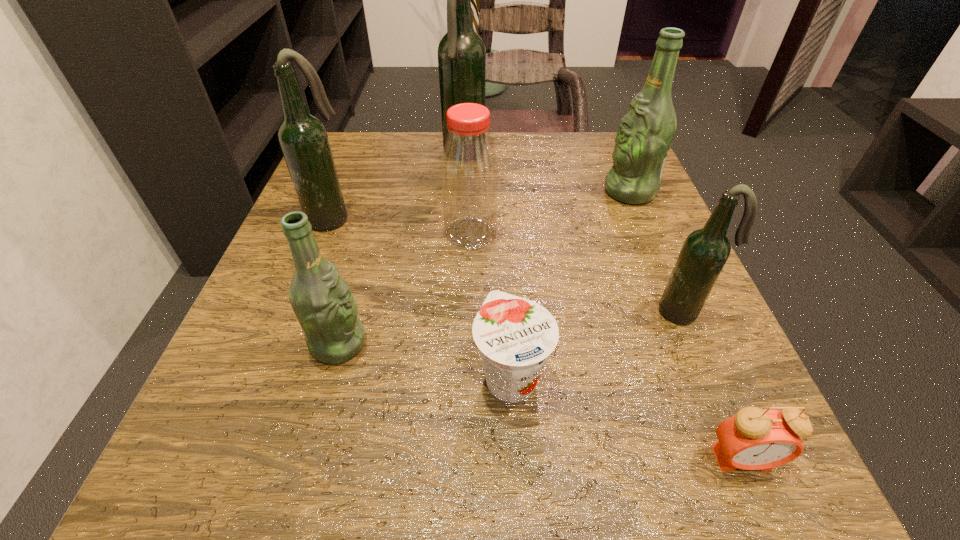
Locate an element on the screen. This screenshot has height=540, width=960. vacant area between the third beer bottle from right to left and the yogurt is located at coordinates click(488, 266).

Locate an element on the screen. free space between the yogurt and the nearest object is located at coordinates [626, 417].

Choose which object is the fifth nearest neighbor to the red bottle. Please provide its 2D coordinates. Your answer should be formatted as a tuple, i.e. [(x, y)], where the tuple contains the x and y coordinates of a point satisfying the conditions above.

[(646, 132)]

Locate an element on the screen. The image size is (960, 540). object that is the closest one to the tallest object is located at coordinates (469, 166).

At what (x,y) coordinates should I click in order to perform the action: click on beer bottle that stands as the third closest to the tallest beer bottle. Please return your answer as a coordinate pair (x, y). This screenshot has width=960, height=540. Looking at the image, I should click on (322, 301).

Identify the location of the closest beer bottle to the alarm clock. (705, 251).

Image resolution: width=960 pixels, height=540 pixels. In order to click on dark beer bottle that is the closest to the nearest dark beer bottle in this screenshot , I will do `click(461, 52)`.

Image resolution: width=960 pixels, height=540 pixels. Find the location of `dark beer bottle that is the closest to the bigger green beer bottle`. dark beer bottle that is the closest to the bigger green beer bottle is located at coordinates (705, 251).

Where is `free spot that satisfies the following two spatial constraints: 1. on the front side of the yogurt; 2. on the left side of the second farthest dark beer bottle`? The height and width of the screenshot is (540, 960). free spot that satisfies the following two spatial constraints: 1. on the front side of the yogurt; 2. on the left side of the second farthest dark beer bottle is located at coordinates (269, 376).

What are the coordinates of `free space that satisfies the following two spatial constraints: 1. on the surface of the second object from left to right; 2. on the right side of the yogurt` in the screenshot? It's located at tap(329, 376).